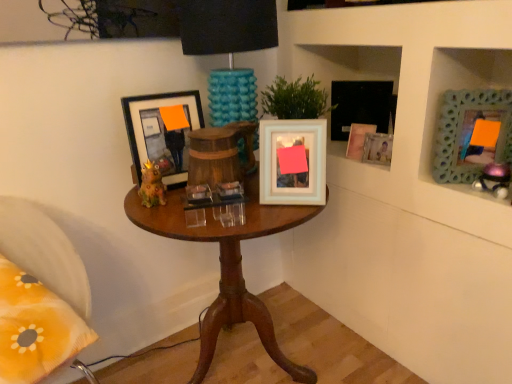
The width and height of the screenshot is (512, 384). What are the coordinates of `vacant point to the right of matte ceramic frog at center, the first toy in the left-to-right sequence` in the screenshot? It's located at (203, 207).